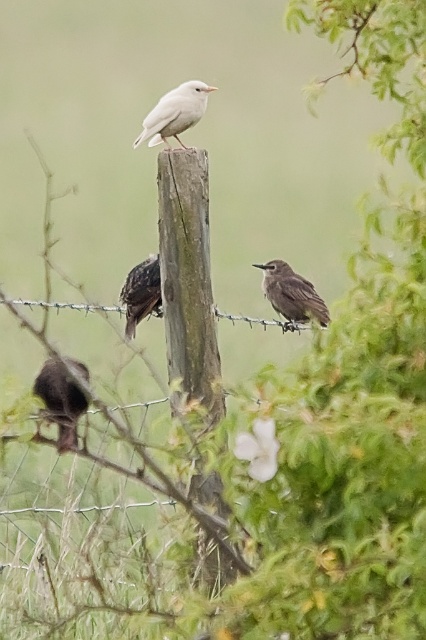
Based on the photo, you are a photographer standing at the camera position. You want to capture a closeup of the wire mesh at center. Given that your camera lens has a minimum focusing distance of 3 meters, can you adjust your position to take the photo without moving the wire mesh?

The wire mesh at center is 5.47 meters away from the camera. Since the minimum focusing distance is 3 meters, you can move closer to the wire mesh at center to within 3 meters to take the closeup.

You are standing in front of the wooden post with birds. There are two points marked in the scene. The first point is at coordinates point [146,291] and the second is at point [245,320]. Which point is closer to you?

Point [146,291] is further to the viewer than point [245,320], so the second point is closer to you.

You are a birdwatcher observing the scene. You notice a brown matte bird at center. Can you determine its exact location in terms of coordinates?

The brown matte bird at center is located at coordinates point (x=291, y=292).